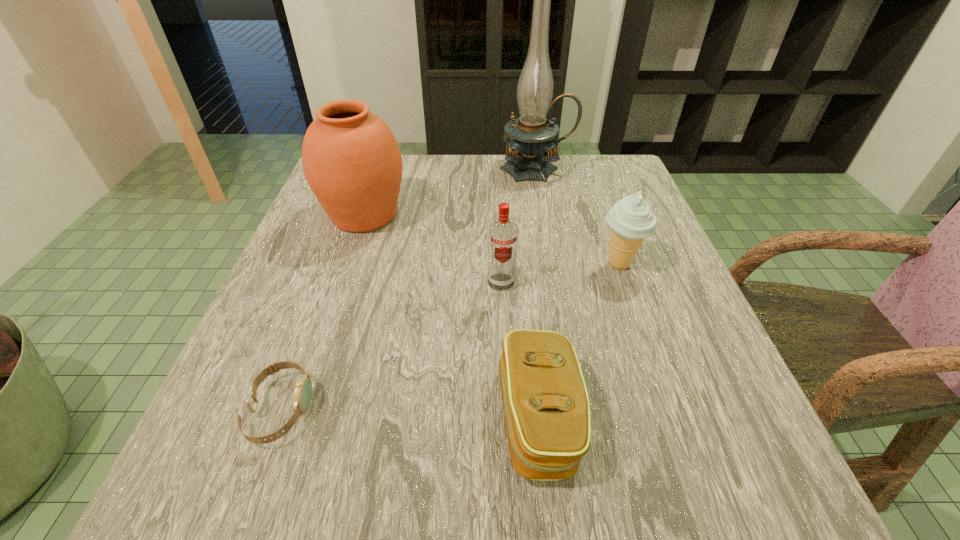
Locate an element on the screen. free space located 0.070m on the front label of the vodka is located at coordinates (503, 321).

At what (x,y) coordinates should I click in order to perform the action: click on vacant space located 0.080m on the left of the icecream. Please return your answer as a coordinate pair (x, y). The image size is (960, 540). Looking at the image, I should click on (555, 264).

The height and width of the screenshot is (540, 960). Identify the location of free space located 0.130m on the zipper side of the second shortest object. (407, 418).

Find the location of `vacant space located 0.230m on the zipper side of the second shortest object`. vacant space located 0.230m on the zipper side of the second shortest object is located at coordinates (335, 418).

Locate an element on the screen. The image size is (960, 540). vacant space located on the zipper side of the second shortest object is located at coordinates (314, 418).

What are the coordinates of `vacant space located on the face of the shortest object` in the screenshot? It's located at (506, 409).

I want to click on oil lamp that is positioned at the far edge, so click(530, 137).

Where is `urn that is at the far edge`? This screenshot has width=960, height=540. urn that is at the far edge is located at coordinates (351, 160).

Find the location of `clutch bag that is at the near edge`. clutch bag that is at the near edge is located at coordinates (547, 411).

Where is `watch located at the near edge`? The image size is (960, 540). watch located at the near edge is located at coordinates pos(303,391).